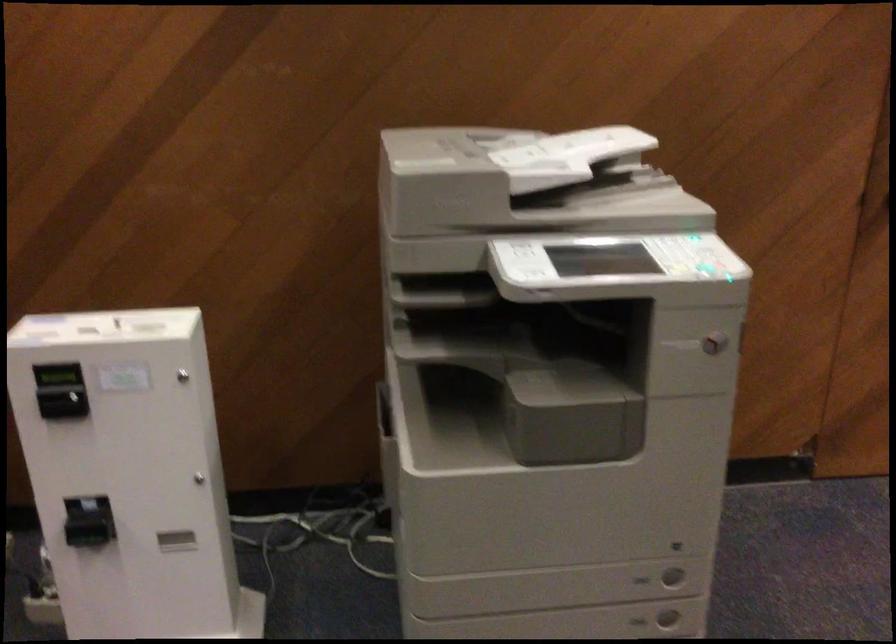
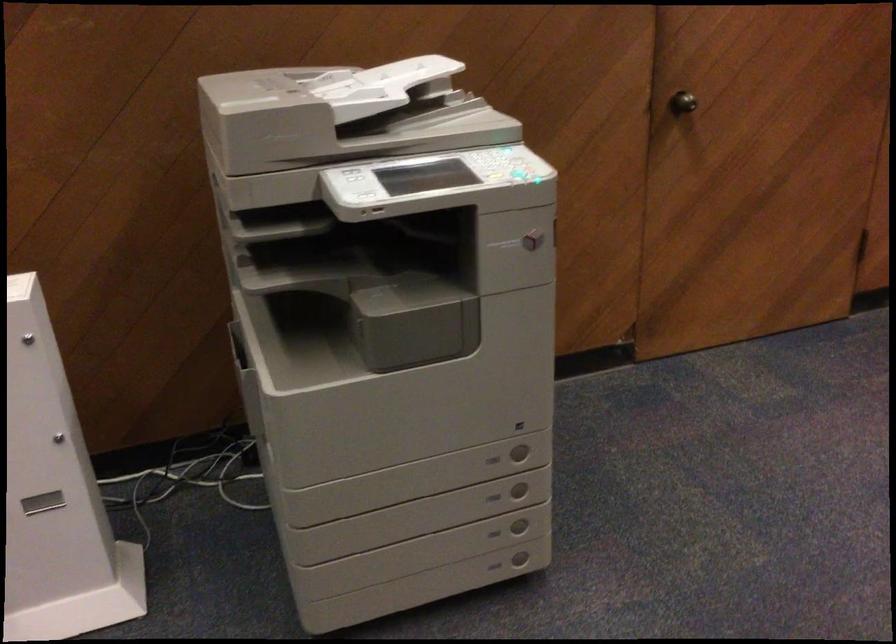
The point at (666, 572) is marked in the first image. Where is the corresponding point in the second image?

(519, 451)